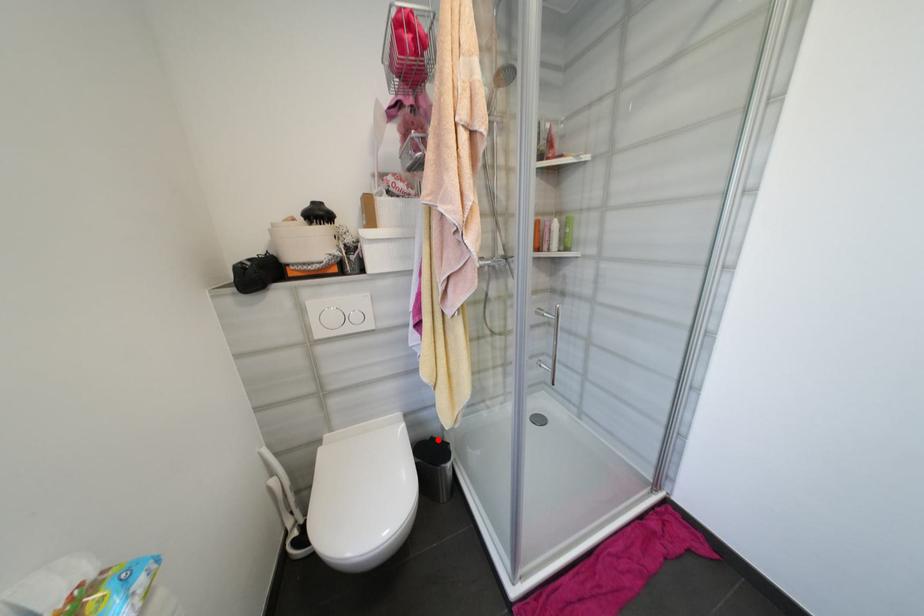
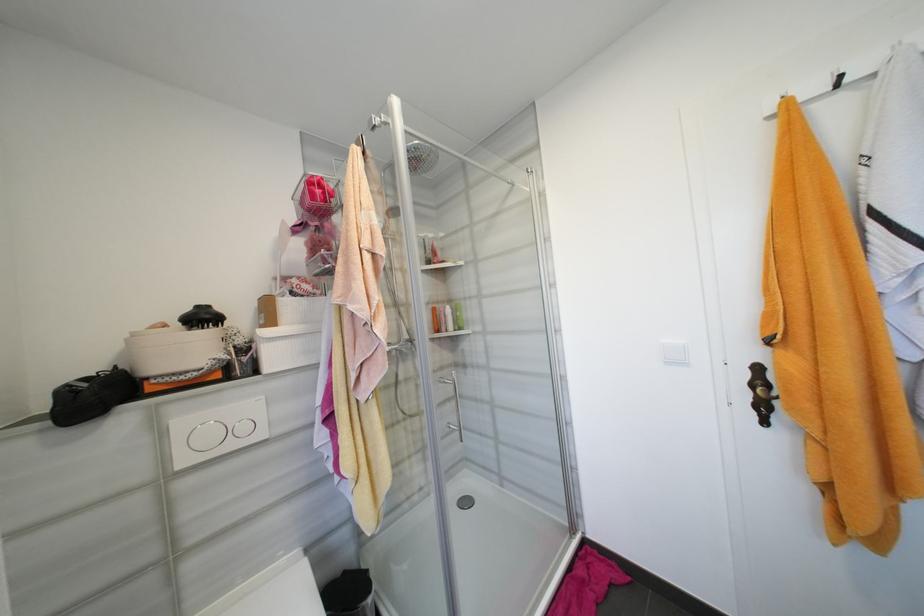
Question: I am providing you with two images of the same scene from different viewpoints. A red point is marked on the first image. Can you still see the location of the red point in image 2?

Choices:
 (A) Yes
 (B) No

Answer: (A)